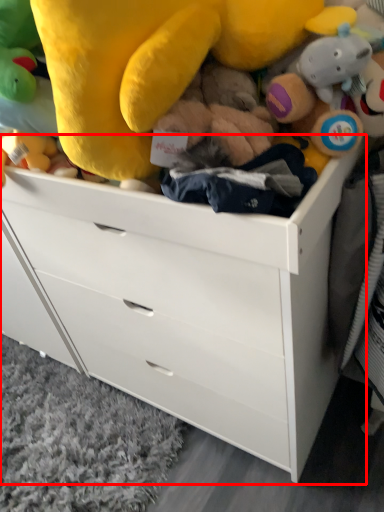
Question: Considering the relative positions of chest of drawers (annotated by the red box) and toy in the image provided, where is chest of drawers (annotated by the red box) located with respect to the staircase?

Choices:
 (A) left
 (B) right

Answer: (B)